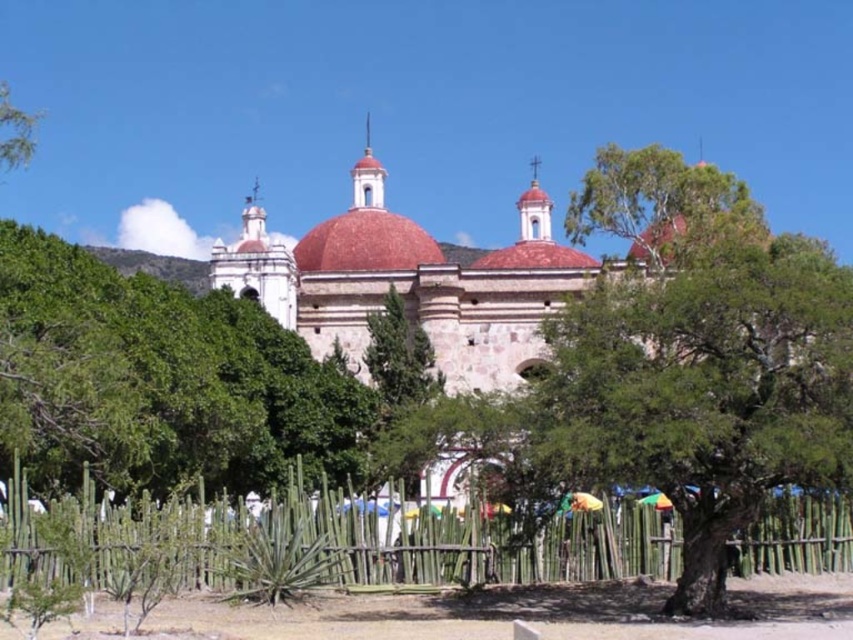
Question: Which object is farther from the camera taking this photo?

Choices:
 (A) green leafy tree at center
 (B) green bamboo fence at lower center

Answer: (A)

Question: Where is green leafy tree at center located in relation to green bamboo fence at lower center in the image?

Choices:
 (A) left
 (B) right

Answer: (A)

Question: Which object appears farthest from the camera in this image?

Choices:
 (A) green leafy tree at center
 (B) green bamboo fence at lower center

Answer: (A)

Question: Does green leafy tree at center have a lesser width compared to green bamboo fence at lower center?

Choices:
 (A) no
 (B) yes

Answer: (B)

Question: Is green leafy tree at center positioned in front of green bamboo fence at lower center?

Choices:
 (A) yes
 (B) no

Answer: (B)